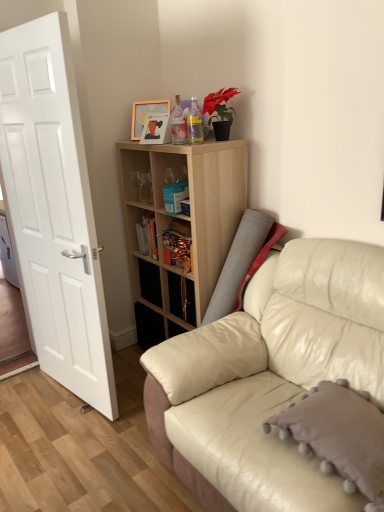
At what (x,y) coordinates should I click in order to perform the action: click on free space in front of white matte door at left. Please return your answer as a coordinate pair (x, y). Looking at the image, I should click on (66, 442).